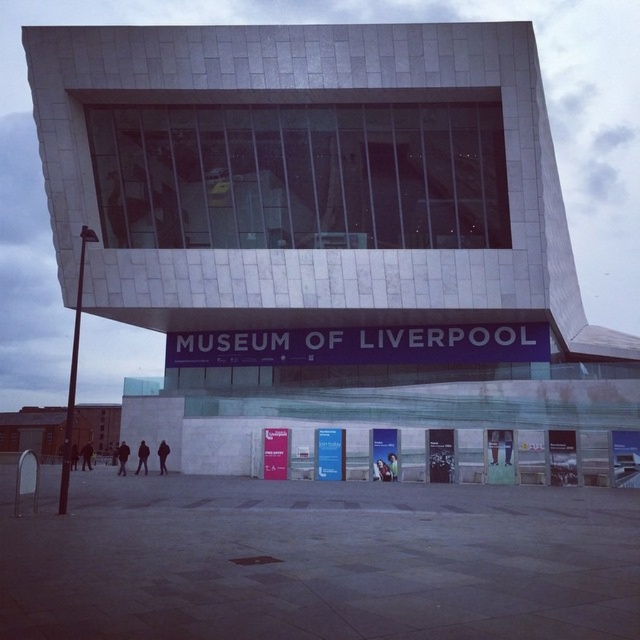
Does point (493, 429) come farther from viewer compared to point (122, 442)?

No, it is in front of (122, 442).

Is point (493, 442) less distant than point (125, 452)?

Yes, it is in front of point (125, 452).

Is point (493, 461) farther from viewer compared to point (125, 442)?

That is False.

What are the coordinates of `light brown wooden sign at center` in the screenshot? It's located at (493, 445).

Is black leather jacket at lower center smaller than dark brown leather jacket at lower center?

Indeed, black leather jacket at lower center has a smaller size compared to dark brown leather jacket at lower center.

Based on the photo, does black leather jacket at lower center have a lesser width compared to dark brown leather jacket at lower center?

No, black leather jacket at lower center is not thinner than dark brown leather jacket at lower center.

Is point (138, 452) farther from viewer compared to point (163, 444)?

Yes, point (138, 452) is behind point (163, 444).

I want to click on black leather jacket at lower center, so click(x=141, y=458).

Can you confirm if black leather jacket at lower center is positioned to the left of dark blue jacket at center?

Incorrect, black leather jacket at lower center is not on the left side of dark blue jacket at center.

From the picture: Who is shorter, black leather jacket at lower center or dark blue jacket at center?

With less height is black leather jacket at lower center.

Is point (140, 465) closer to camera compared to point (115, 445)?

Yes, it is in front of point (115, 445).

Identify the location of black leather jacket at lower center. This screenshot has width=640, height=640. (141, 458).